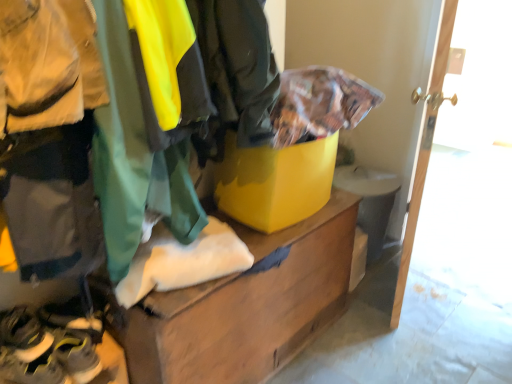
This screenshot has width=512, height=384. Find the location of `yellow rubber shoes at lower left, which appears as the second footwear when ordered from the bottom`. yellow rubber shoes at lower left, which appears as the second footwear when ordered from the bottom is located at coordinates (24, 335).

What is the approximate height of yellow mesh sneakers at lower left, which is the 1th footwear in bottom-to-top order?

11.43 centimeters.

Where is `yellow rubber shoes at lower left, which is the first footwear from top to bottom`? The height and width of the screenshot is (384, 512). yellow rubber shoes at lower left, which is the first footwear from top to bottom is located at coordinates (24, 335).

Consider the image. Is yellow matte cardboard box at center in front of or behind yellow mesh sneakers at lower left, the second footwear positioned from the top, in the image?

In the image, yellow matte cardboard box at center appears behind yellow mesh sneakers at lower left, the second footwear positioned from the top.

Considering the sizes of yellow matte cardboard box at center and yellow mesh sneakers at lower left, which is the 1th footwear in bottom-to-top order, in the image, is yellow matte cardboard box at center taller or shorter than yellow mesh sneakers at lower left, which is the 1th footwear in bottom-to-top order,?

Clearly, yellow matte cardboard box at center is taller compared to yellow mesh sneakers at lower left, which is the 1th footwear in bottom-to-top order.

Does yellow matte cardboard box at center contain yellow mesh sneakers at lower left, which is the 1th footwear in bottom-to-top order?

No, yellow mesh sneakers at lower left, which is the 1th footwear in bottom-to-top order, is located outside of yellow matte cardboard box at center.

How far apart are yellow matte cardboard box at center and yellow mesh sneakers at lower left, which is the 1th footwear in bottom-to-top order?

A distance of 75.92 centimeters exists between yellow matte cardboard box at center and yellow mesh sneakers at lower left, which is the 1th footwear in bottom-to-top order.

From the picture: How different are the orientations of yellow matte cardboard box at center and wooden door at right in degrees?

yellow matte cardboard box at center and wooden door at right are facing 21.7 degrees away from each other.

From a real-world perspective, which is physically below, yellow matte cardboard box at center or wooden door at right?

wooden door at right, from a real-world perspective.

From the image's perspective, is yellow matte cardboard box at center below wooden door at right?

Correct, yellow matte cardboard box at center appears lower than wooden door at right in the image.

Considering the sizes of objects wooden chest at center and yellow mesh sneakers at lower left, the second footwear positioned from the top, in the image provided, who is taller, wooden chest at center or yellow mesh sneakers at lower left, the second footwear positioned from the top,?

wooden chest at center is taller.

From the image's perspective, who appears lower, wooden chest at center or yellow mesh sneakers at lower left, which is the 1th footwear in bottom-to-top order?

yellow mesh sneakers at lower left, which is the 1th footwear in bottom-to-top order, is shown below in the image.

Considering the sizes of objects wooden chest at center and yellow mesh sneakers at lower left, the second footwear positioned from the top, in the image provided, who is thinner, wooden chest at center or yellow mesh sneakers at lower left, the second footwear positioned from the top,?

Thinner between the two is yellow mesh sneakers at lower left, the second footwear positioned from the top.

Who is shorter, wooden door at right or yellow mesh sneakers at lower left, the second footwear positioned from the top?

With less height is yellow mesh sneakers at lower left, the second footwear positioned from the top.

Which is more to the left, wooden door at right or yellow mesh sneakers at lower left, which is the 1th footwear in bottom-to-top order?

yellow mesh sneakers at lower left, which is the 1th footwear in bottom-to-top order.

Is wooden door at right facing away from yellow mesh sneakers at lower left, which is the 1th footwear in bottom-to-top order?

No.

How different are the orientations of wooden door at right and yellow matte cardboard box at center in degrees?

The angular difference between wooden door at right and yellow matte cardboard box at center is 21.7 degrees.

Considering the relative sizes of wooden door at right and yellow matte cardboard box at center in the image provided, is wooden door at right bigger than yellow matte cardboard box at center?

Correct, wooden door at right is larger in size than yellow matte cardboard box at center.

Locate an element on the screen. This screenshot has width=512, height=384. cardboard box that appears below the wooden door at right (from the image's perspective) is located at coordinates (275, 182).

Is yellow matte cardboard box at center oriented away from yellow rubber shoes at lower left, which is the first footwear from top to bottom?

yellow matte cardboard box at center is not turned away from yellow rubber shoes at lower left, which is the first footwear from top to bottom.

Which point is more distant from viewer, [315,186] or [22,333]?

The point [315,186] is farther from the camera.

From a real-world perspective, is yellow matte cardboard box at center under yellow rubber shoes at lower left, which is the first footwear from top to bottom?

No, from a real-world perspective, yellow matte cardboard box at center is not beneath yellow rubber shoes at lower left, which is the first footwear from top to bottom.

In the scene shown: Is yellow mesh sneakers at lower left, the second footwear positioned from the top, inside or outside of wooden chest at center?

yellow mesh sneakers at lower left, the second footwear positioned from the top, exists outside the volume of wooden chest at center.

From the image's perspective, which is below, yellow mesh sneakers at lower left, which is the 1th footwear in bottom-to-top order, or wooden chest at center?

yellow mesh sneakers at lower left, which is the 1th footwear in bottom-to-top order, is shown below in the image.

Could you measure the distance between yellow mesh sneakers at lower left, which is the 1th footwear in bottom-to-top order, and wooden chest at center?

They are 18.50 inches apart.

Does yellow mesh sneakers at lower left, which is the 1th footwear in bottom-to-top order, come in front of wooden chest at center?

No, yellow mesh sneakers at lower left, which is the 1th footwear in bottom-to-top order, is behind wooden chest at center.

From the image's perspective, which footwear is the 2nd one below the yellow matte cardboard box at center? Please provide its 2D coordinates.

[(44, 352)]

Find the location of `cardboard box that appears on the left of wooden door at right`. cardboard box that appears on the left of wooden door at right is located at coordinates pyautogui.click(x=275, y=182).

When comparing their distances from yellow rubber shoes at lower left, which appears as the second footwear when ordered from the bottom, does wooden door at right or wooden chest at center seem closer?

wooden chest at center is positioned closer to the anchor yellow rubber shoes at lower left, which appears as the second footwear when ordered from the bottom.

Based on their spatial positions, is wooden door at right or yellow rubber shoes at lower left, which is the first footwear from top to bottom, further from yellow mesh sneakers at lower left, which is the 1th footwear in bottom-to-top order?

Among the two, wooden door at right is located further to yellow mesh sneakers at lower left, which is the 1th footwear in bottom-to-top order.

Looking at the image, which one is located closer to yellow rubber shoes at lower left, which is the first footwear from top to bottom, wooden door at right or yellow mesh sneakers at lower left, which is the 1th footwear in bottom-to-top order?

Among the two, yellow mesh sneakers at lower left, which is the 1th footwear in bottom-to-top order, is located nearer to yellow rubber shoes at lower left, which is the first footwear from top to bottom.

Based on their spatial positions, is wooden door at right or wooden chest at center closer to yellow mesh sneakers at lower left, which is the 1th footwear in bottom-to-top order?

The object closer to yellow mesh sneakers at lower left, which is the 1th footwear in bottom-to-top order, is wooden chest at center.

Estimate the real-world distances between objects in this image. Which object is closer to yellow mesh sneakers at lower left, the second footwear positioned from the top, yellow rubber shoes at lower left, which is the first footwear from top to bottom, or yellow matte cardboard box at center?

yellow rubber shoes at lower left, which is the first footwear from top to bottom, lies closer to yellow mesh sneakers at lower left, the second footwear positioned from the top, than the other object.

From the picture: Considering their positions, is yellow rubber shoes at lower left, which is the first footwear from top to bottom, positioned closer to yellow mesh sneakers at lower left, the second footwear positioned from the top, than wooden chest at center?

yellow rubber shoes at lower left, which is the first footwear from top to bottom, is positioned closer to the anchor yellow mesh sneakers at lower left, the second footwear positioned from the top.

Looking at the image, which one is located closer to yellow matte cardboard box at center, wooden chest at center or yellow rubber shoes at lower left, which is the first footwear from top to bottom?

wooden chest at center is closer to yellow matte cardboard box at center.

Estimate the real-world distances between objects in this image. Which object is closer to yellow matte cardboard box at center, yellow mesh sneakers at lower left, which is the 1th footwear in bottom-to-top order, or wooden door at right?

wooden door at right.

Where is `furniture between yellow mesh sneakers at lower left, the second footwear positioned from the top, and yellow matte cardboard box at center`? The width and height of the screenshot is (512, 384). furniture between yellow mesh sneakers at lower left, the second footwear positioned from the top, and yellow matte cardboard box at center is located at coordinates (247, 305).

I want to click on furniture between yellow rubber shoes at lower left, which is the first footwear from top to bottom, and wooden door at right, in the horizontal direction, so click(x=247, y=305).

You are a GUI agent. You are given a task and a screenshot of the screen. Output one action in this format:
    pyautogui.click(x=<x>, y=<y>)
    Task: Click on the footwear between yellow rubber shoes at lower left, which appears as the second footwear when ordered from the bottom, and yellow matte cardboard box at center
    The width and height of the screenshot is (512, 384).
    Given the screenshot: What is the action you would take?
    pyautogui.click(x=44, y=352)

This screenshot has width=512, height=384. I want to click on furniture between yellow mesh sneakers at lower left, the second footwear positioned from the top, and wooden door at right, so click(247, 305).